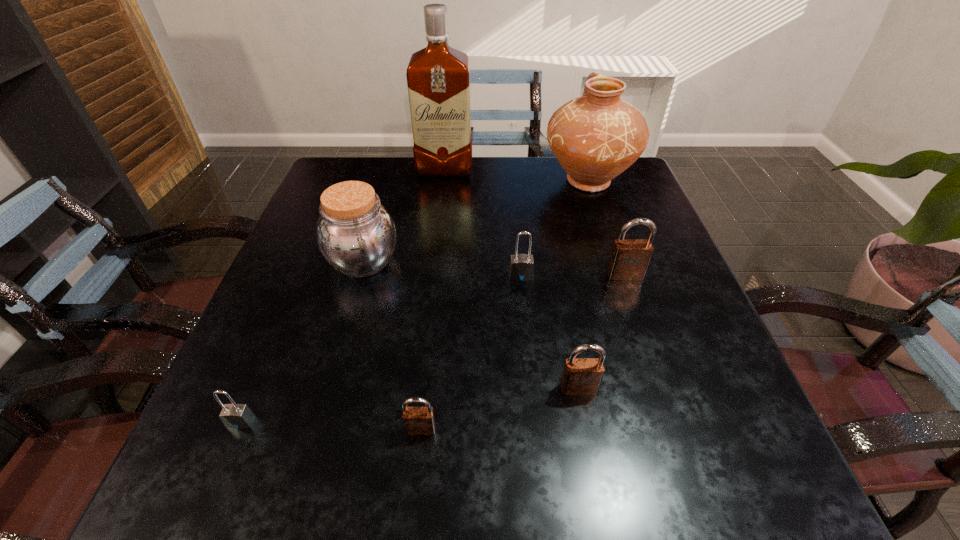
You are a GUI agent. You are given a task and a screenshot of the screen. Output one action in this format:
    pyautogui.click(x=<x>, y=<y>)
    Task: Click on the liquor
    This screenshot has width=960, height=540.
    Given the screenshot: What is the action you would take?
    pyautogui.click(x=438, y=77)

The image size is (960, 540). I want to click on the second tallest object, so click(595, 137).

The width and height of the screenshot is (960, 540). In order to click on jar in this screenshot , I will do `click(356, 234)`.

Identify the location of the tallest padlock. This screenshot has width=960, height=540. (630, 258).

Identify the location of the rightmost brown padlock. Image resolution: width=960 pixels, height=540 pixels. click(630, 258).

The height and width of the screenshot is (540, 960). In order to click on the bigger gray padlock in this screenshot , I will do `click(521, 267)`.

Where is `the farther gray padlock`? This screenshot has height=540, width=960. the farther gray padlock is located at coordinates (521, 267).

Where is `the second padlock from right to left`? The width and height of the screenshot is (960, 540). the second padlock from right to left is located at coordinates (581, 376).

The image size is (960, 540). In order to click on the second brown padlock from left to right in this screenshot , I will do `click(581, 376)`.

In order to click on the nearer gray padlock in this screenshot , I will do `click(237, 416)`.